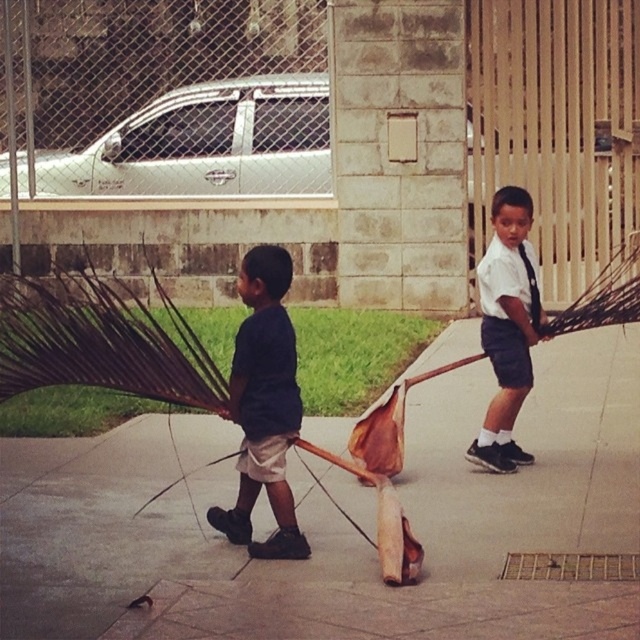
Which is below, brown concrete pavement at center or white shirt at center?

brown concrete pavement at center

Does brown concrete pavement at center have a larger size compared to white shirt at center?

Actually, brown concrete pavement at center might be smaller than white shirt at center.

Is point (449, 444) more distant than point (500, 298)?

Yes, point (449, 444) is behind point (500, 298).

I want to click on brown concrete pavement at center, so click(x=339, y=524).

Measure the distance between dark blue shirt at center and white shirt at center.

dark blue shirt at center and white shirt at center are 1.94 meters apart from each other.

Is point (230, 541) less distant than point (522, 458)?

That is True.

Find the location of a particular element. This screenshot has width=640, height=640. dark blue shirt at center is located at coordinates (262, 404).

Does brown concrete pavement at center have a lesser height compared to dark blue shirt at center?

Yes.

Looking at this image, between brown concrete pavement at center and dark blue shirt at center, which one has more height?

Standing taller between the two is dark blue shirt at center.

The image size is (640, 640). Identify the location of brown concrete pavement at center. (339, 524).